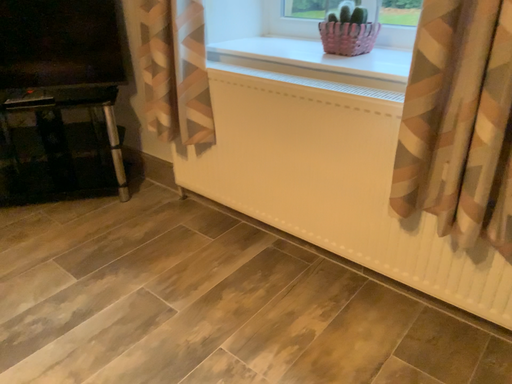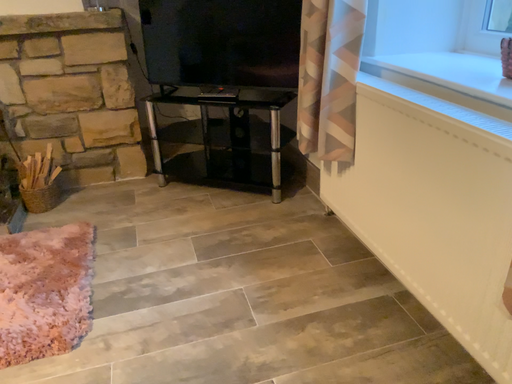
Question: How did the camera likely rotate when shooting the video?

Choices:
 (A) rotated right
 (B) rotated left

Answer: (B)